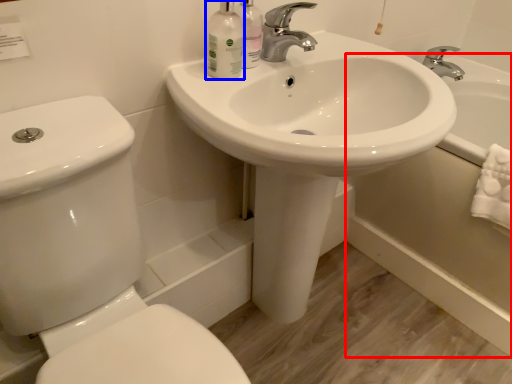
Question: Which of the following is the farthest to the observer, bath (highlighted by a red box) or mouthwash (highlighted by a blue box)?

Choices:
 (A) bath
 (B) mouthwash

Answer: (A)